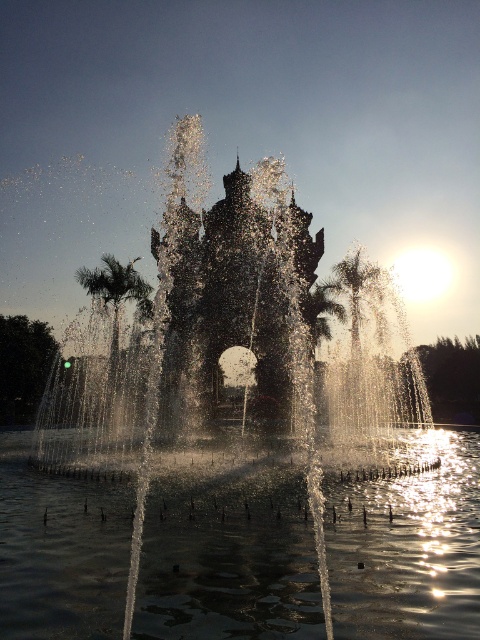
Looking at this image, can you confirm if clear liquid water at center is positioned to the right of green leafy palm tree at left?

Correct, you'll find clear liquid water at center to the right of green leafy palm tree at left.

Is clear liquid water at center smaller than green leafy palm tree at left?

Incorrect, clear liquid water at center is not smaller in size than green leafy palm tree at left.

Measure the distance between point (213, 564) and camera.

Point (213, 564) and camera are 382.51 feet apart.

I want to click on clear liquid water at center, so click(x=409, y=548).